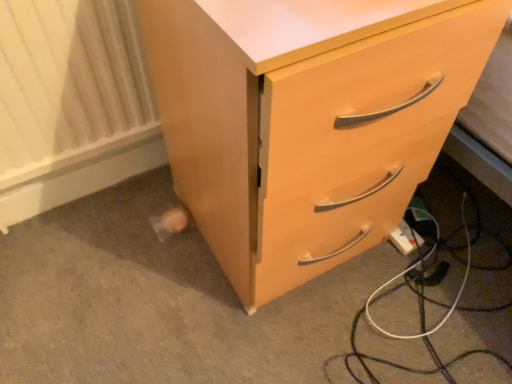
Question: Can you confirm if white plastic extension cord at lower right is smaller than white textured radiator at lower left?

Choices:
 (A) yes
 (B) no

Answer: (A)

Question: From a real-world perspective, is white plastic extension cord at lower right under white textured radiator at lower left?

Choices:
 (A) yes
 (B) no

Answer: (A)

Question: Does white plastic extension cord at lower right have a lesser height compared to white textured radiator at lower left?

Choices:
 (A) yes
 (B) no

Answer: (A)

Question: From a real-world perspective, is white plastic extension cord at lower right on white textured radiator at lower left?

Choices:
 (A) yes
 (B) no

Answer: (B)

Question: Is white plastic extension cord at lower right thinner than white textured radiator at lower left?

Choices:
 (A) yes
 (B) no

Answer: (B)

Question: Is white plastic extension cord at lower right inside the boundaries of white textured radiator at lower left, or outside?

Choices:
 (A) outside
 (B) inside

Answer: (A)

Question: From a real-world perspective, relative to white textured radiator at lower left, is white plastic extension cord at lower right vertically above or below?

Choices:
 (A) above
 (B) below

Answer: (B)

Question: Visually, is white plastic extension cord at lower right positioned to the left or to the right of white textured radiator at lower left?

Choices:
 (A) left
 (B) right

Answer: (B)

Question: From the image's perspective, is white plastic extension cord at lower right above or below white textured radiator at lower left?

Choices:
 (A) above
 (B) below

Answer: (B)

Question: From their relative heights in the image, would you say white plastic extension cord at lower right is taller or shorter than matte wood chest of drawers at lower right?

Choices:
 (A) short
 (B) tall

Answer: (A)

Question: From the image's perspective, is white plastic extension cord at lower right positioned above or below matte wood chest of drawers at lower right?

Choices:
 (A) below
 (B) above

Answer: (A)

Question: Looking at the image, does white plastic extension cord at lower right seem bigger or smaller compared to matte wood chest of drawers at lower right?

Choices:
 (A) big
 (B) small

Answer: (B)

Question: From a real-world perspective, is white plastic extension cord at lower right positioned above or below matte wood chest of drawers at lower right?

Choices:
 (A) above
 (B) below

Answer: (B)

Question: Considering the positions of matte wood chest of drawers at lower right and white plastic extension cord at lower right in the image, is matte wood chest of drawers at lower right wider or thinner than white plastic extension cord at lower right?

Choices:
 (A) wide
 (B) thin

Answer: (A)

Question: From a real-world perspective, relative to white plastic extension cord at lower right, is matte wood chest of drawers at lower right vertically above or below?

Choices:
 (A) below
 (B) above

Answer: (B)